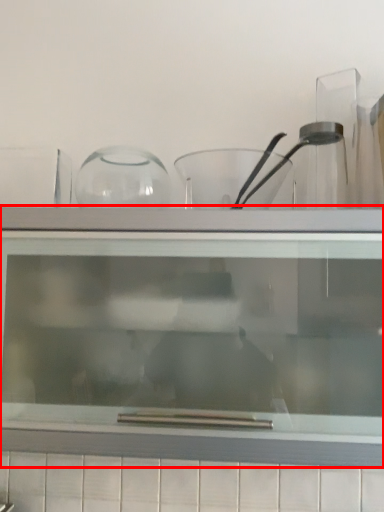
Question: From the image's perspective, where is shelf (annotated by the red box) located relative to bowl?

Choices:
 (A) below
 (B) above

Answer: (A)